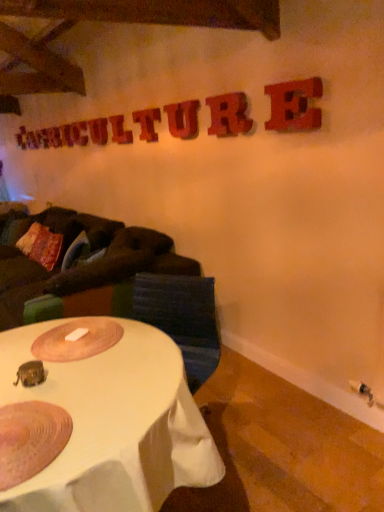
Question: Which direction should I rotate to look at wooden letter at upper center, the fourth letter viewed from the back?

Choices:
 (A) right
 (B) left

Answer: (B)

Question: Is dark brown fabric couch at left not near rusty metal letter e at upper right, the 1th letter viewed from the right?

Choices:
 (A) no
 (B) yes

Answer: (B)

Question: Is dark brown fabric couch at left oriented away from rusty metal letter e at upper right, marked as the 8th letter in a back-to-front arrangement?

Choices:
 (A) yes
 (B) no

Answer: (B)

Question: Is the depth of dark brown fabric couch at left less than that of rusty metal letter e at upper right, which is the 8th letter from left to right?

Choices:
 (A) yes
 (B) no

Answer: (B)

Question: Does dark brown fabric couch at left have a greater width compared to rusty metal letter e at upper right, marked as the 8th letter in a back-to-front arrangement?

Choices:
 (A) no
 (B) yes

Answer: (B)

Question: From a real-world perspective, is dark brown fabric couch at left over rusty metal letter e at upper right, the 1th letter viewed from the right?

Choices:
 (A) no
 (B) yes

Answer: (A)

Question: From a real-world perspective, is dark brown fabric couch at left below rusty metal letter e at upper right, the 1th letter viewed from the right?

Choices:
 (A) no
 (B) yes

Answer: (B)

Question: Is wooden letter at upper center, which is the fifth letter from right to left, bigger than textured fabric swivel chair at center?

Choices:
 (A) yes
 (B) no

Answer: (B)

Question: Is textured fabric swivel chair at center inside wooden letter at upper center, which is the fifth letter from right to left?

Choices:
 (A) no
 (B) yes

Answer: (A)

Question: Is wooden letter at upper center, the 5th letter in the front-to-back sequence, positioned with its back to textured fabric swivel chair at center?

Choices:
 (A) yes
 (B) no

Answer: (B)

Question: Is wooden letter at upper center, which is the fifth letter from right to left, not close to textured fabric swivel chair at center?

Choices:
 (A) yes
 (B) no

Answer: (A)

Question: Is wooden letter at upper center, the fourth letter viewed from the back, with textured fabric swivel chair at center?

Choices:
 (A) no
 (B) yes

Answer: (A)

Question: Can you confirm if wooden letter at upper center, the 5th letter in the front-to-back sequence, is shorter than textured fabric swivel chair at center?

Choices:
 (A) no
 (B) yes

Answer: (B)

Question: Can you confirm if textured multicolored pillow at left is shorter than rusty metal letter e at upper right, the 1th letter viewed from the right?

Choices:
 (A) no
 (B) yes

Answer: (A)